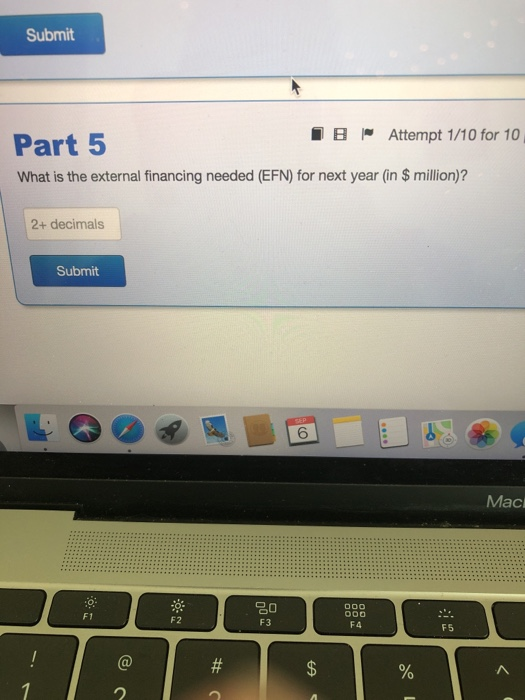
Image resolution: width=525 pixels, height=700 pixels. Identify the location of laptop. (16, 545).